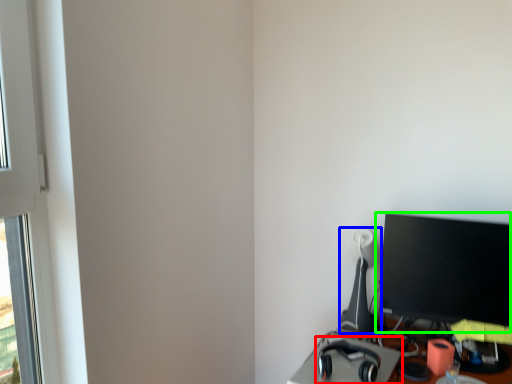
Question: Which object is the closest to the headphones (highlighted by a red box)? Choose among these: table lamp (highlighted by a blue box) or computer monitor (highlighted by a green box).

Choices:
 (A) table lamp
 (B) computer monitor

Answer: (A)